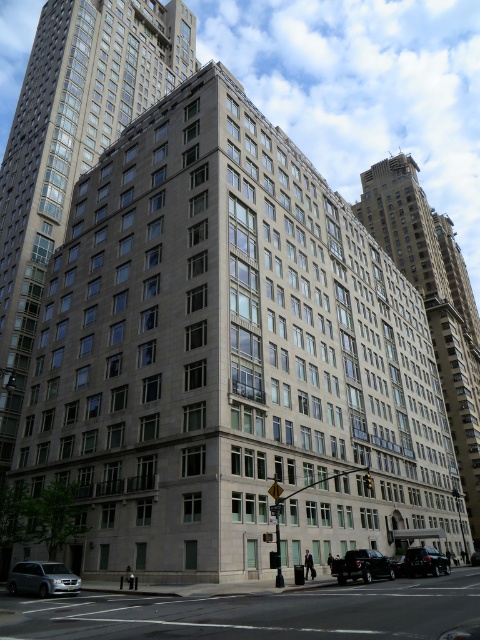
Who is lower down, gray stone building at center or smooth concrete building at center?

smooth concrete building at center

Describe the element at coordinates (72, 144) in the screenshot. I see `gray stone building at center` at that location.

Describe the element at coordinates (72, 144) in the screenshot. The image size is (480, 640). I see `gray stone building at center` at that location.

You are a GUI agent. You are given a task and a screenshot of the screen. Output one action in this format:
    pyautogui.click(x=<x>, y=<y>)
    Task: Click on the gray stone building at center
    The height and width of the screenshot is (640, 480).
    Given the screenshot: What is the action you would take?
    pyautogui.click(x=72, y=144)

Is gray stone building at center to the right of shiny black car at lower right from the viewer's perspective?

No, gray stone building at center is not to the right of shiny black car at lower right.

Does gray stone building at center appear over shiny black car at lower right?

Yes, gray stone building at center is above shiny black car at lower right.

Does point (105, 67) come in front of point (418, 561)?

No, (105, 67) is further to viewer.

You are a GUI agent. You are given a task and a screenshot of the screen. Output one action in this format:
    pyautogui.click(x=<x>, y=<y>)
    Task: Click on the gray stone building at center
    
    Given the screenshot: What is the action you would take?
    pyautogui.click(x=72, y=144)

Based on the photo, who is more distant from viewer, (x=60, y=582) or (x=414, y=572)?

Positioned behind is point (x=414, y=572).

Does silver metallic van at lower left have a greater height compared to shiny black car at lower right?

No.

Is point (40, 586) farther from camera compared to point (447, 561)?

No, it is not.

You are a GUI agent. You are given a task and a screenshot of the screen. Output one action in this format:
    pyautogui.click(x=<x>, y=<y>)
    Task: Click on the silver metallic van at lower left
    This screenshot has height=640, width=480.
    Given the screenshot: What is the action you would take?
    (43, 579)